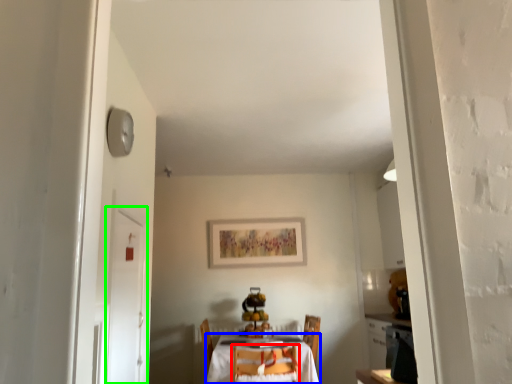
Question: Which object is the farthest from chair (highlighted by a red box)? Choose among these: table (highlighted by a blue box) or door (highlighted by a green box).

Choices:
 (A) table
 (B) door

Answer: (B)